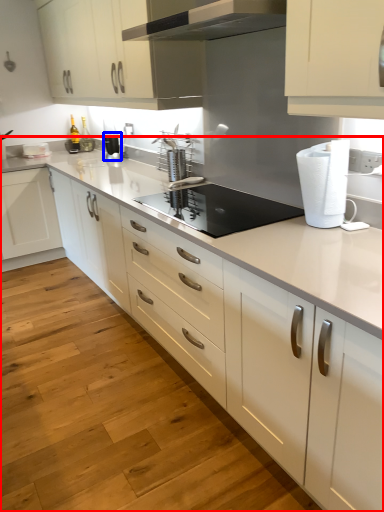
Question: Which of the following is the farthest to the observer, countertop (highlighted by a red box) or kitchen appliance (highlighted by a blue box)?

Choices:
 (A) countertop
 (B) kitchen appliance

Answer: (B)